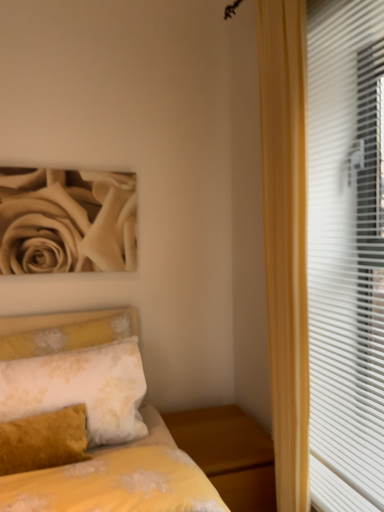
Where is `vacant area situated below beige matte rose at upper left (from a real-world perspective)`? This screenshot has height=512, width=384. vacant area situated below beige matte rose at upper left (from a real-world perspective) is located at coordinates (71, 303).